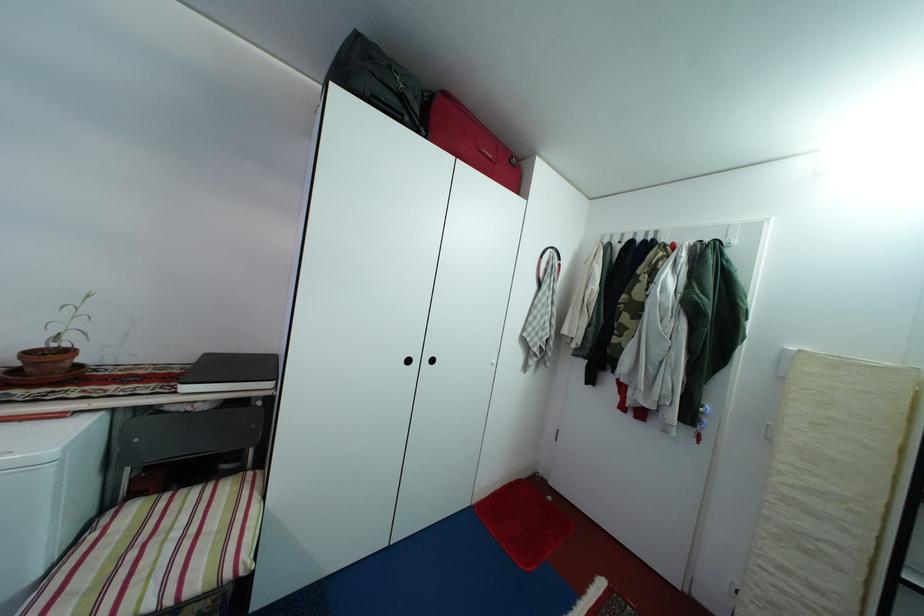
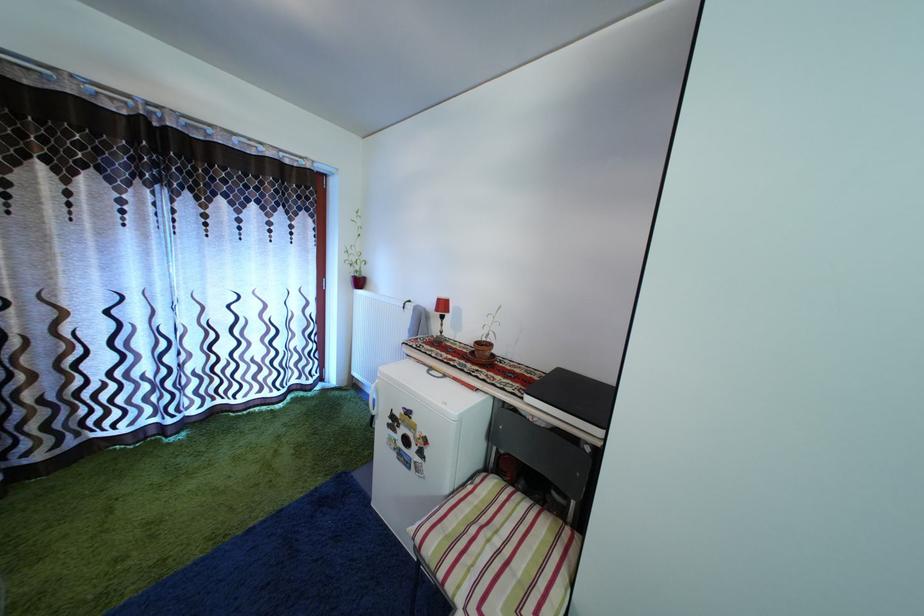
In the second image, find the point that corresponds to point (38, 361) in the first image.

(485, 350)